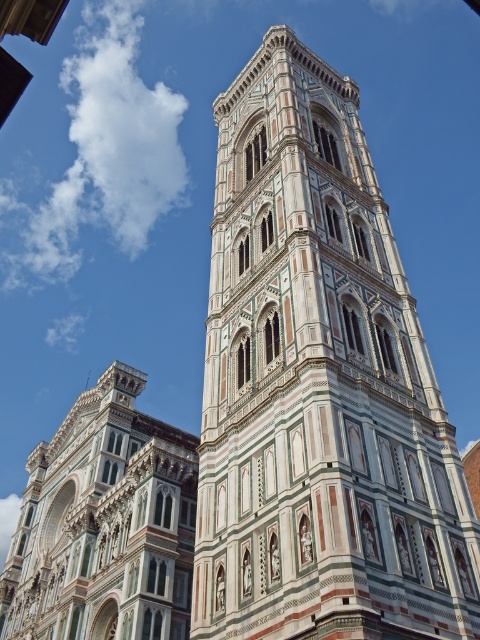
Question: Can you confirm if multicolored stone tower at center is positioned to the left of multicolored mosaic tower at center?

Choices:
 (A) yes
 (B) no

Answer: (B)

Question: Is multicolored stone tower at center below multicolored mosaic tower at center?

Choices:
 (A) yes
 (B) no

Answer: (B)

Question: Can you confirm if multicolored stone tower at center is wider than multicolored mosaic tower at center?

Choices:
 (A) no
 (B) yes

Answer: (A)